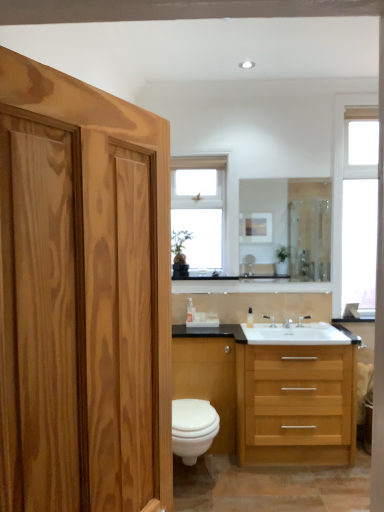
Question: Is white glossy toilet at lower center taller than light wood/finish sink at lower right?

Choices:
 (A) no
 (B) yes

Answer: (A)

Question: Are white glossy toilet at lower center and light wood/finish sink at lower right beside each other?

Choices:
 (A) no
 (B) yes

Answer: (A)

Question: Is the depth of white glossy toilet at lower center greater than that of light wood/finish sink at lower right?

Choices:
 (A) no
 (B) yes

Answer: (A)

Question: Is white glossy toilet at lower center positioned in front of light wood/finish sink at lower right?

Choices:
 (A) yes
 (B) no

Answer: (A)

Question: Considering the relative sizes of white glossy toilet at lower center and light wood/finish sink at lower right in the image provided, is white glossy toilet at lower center wider than light wood/finish sink at lower right?

Choices:
 (A) yes
 (B) no

Answer: (A)

Question: Is white glossy toilet at lower center bigger than light wood/finish sink at lower right?

Choices:
 (A) yes
 (B) no

Answer: (B)

Question: Considering the relative sizes of white glass window at upper right, the 1th window positioned from the right, and clear glass mirror at center in the image provided, is white glass window at upper right, the 1th window positioned from the right, wider than clear glass mirror at center?

Choices:
 (A) yes
 (B) no

Answer: (A)

Question: Considering the relative sizes of white glass window at upper right, the 1th window positioned from the right, and clear glass mirror at center in the image provided, is white glass window at upper right, the 1th window positioned from the right, taller than clear glass mirror at center?

Choices:
 (A) yes
 (B) no

Answer: (A)

Question: Does white glass window at upper right, which appears as the 2th window when viewed from the left, have a lesser width compared to clear glass mirror at center?

Choices:
 (A) no
 (B) yes

Answer: (A)

Question: Considering the relative sizes of white glass window at upper right, the 1th window positioned from the right, and clear glass mirror at center in the image provided, is white glass window at upper right, the 1th window positioned from the right, bigger than clear glass mirror at center?

Choices:
 (A) no
 (B) yes

Answer: (B)

Question: Considering the relative sizes of white glass window at upper right, the 1th window positioned from the right, and clear glass mirror at center in the image provided, is white glass window at upper right, the 1th window positioned from the right, shorter than clear glass mirror at center?

Choices:
 (A) no
 (B) yes

Answer: (A)

Question: Considering the relative sizes of white glass window at upper right, which appears as the 2th window when viewed from the left, and clear glass mirror at center in the image provided, is white glass window at upper right, which appears as the 2th window when viewed from the left, smaller than clear glass mirror at center?

Choices:
 (A) yes
 (B) no

Answer: (B)

Question: Considering the relative positions of white glossy toilet at lower center and silver metallic faucet at sink right, marked as the second faucet in a left-to-right arrangement, in the image provided, is white glossy toilet at lower center to the right of silver metallic faucet at sink right, marked as the second faucet in a left-to-right arrangement, from the viewer's perspective?

Choices:
 (A) no
 (B) yes

Answer: (A)